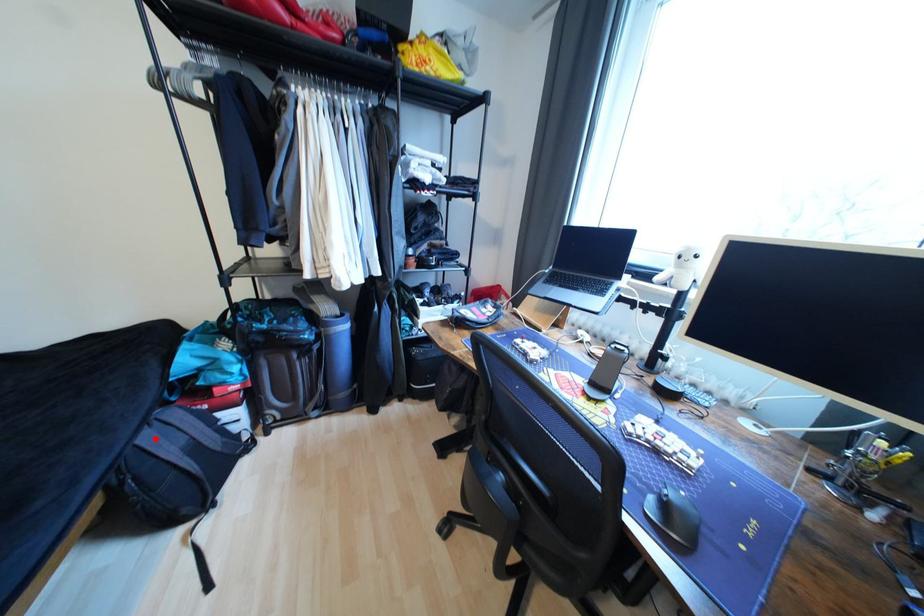
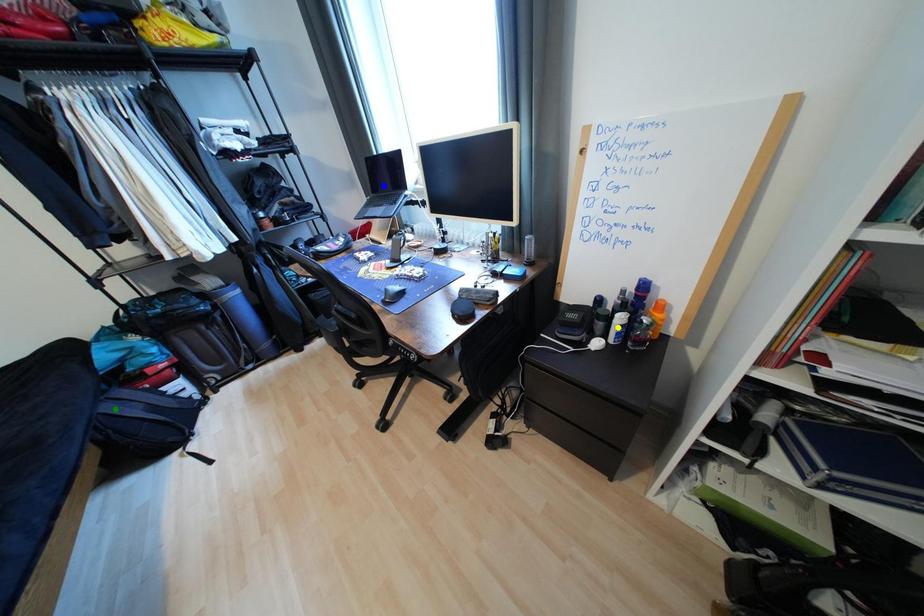
Question: I am providing you with two images of the same scene from different viewpoints. A red point is marked on the first image. You are given multiple points on the second image. In image 2, which mark is for the same physical point as the one in image 1?

Choices:
 (A) blue point
 (B) yellow point
 (C) green point

Answer: (C)